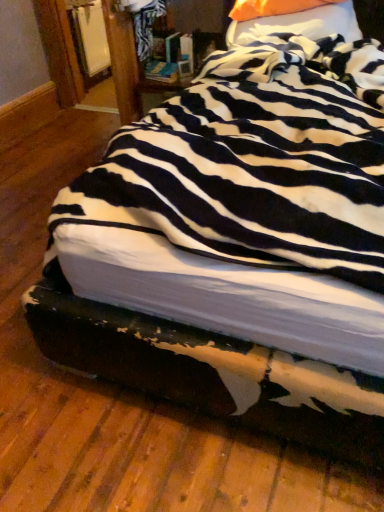
The height and width of the screenshot is (512, 384). What do you see at coordinates (291, 19) in the screenshot?
I see `orange fabric pillow at upper center, arranged as the second pillow when viewed from the top` at bounding box center [291, 19].

Image resolution: width=384 pixels, height=512 pixels. Find the location of `orange fabric pillow at upper center, arranged as the second pillow when viewed from the top`. orange fabric pillow at upper center, arranged as the second pillow when viewed from the top is located at coordinates (291, 19).

Find the location of a particular element. The height and width of the screenshot is (512, 384). orange fabric pillow at upper center, acting as the 2th pillow starting from the bottom is located at coordinates (273, 8).

Image resolution: width=384 pixels, height=512 pixels. What do you see at coordinates (273, 8) in the screenshot?
I see `orange fabric pillow at upper center, which is the first pillow in top-to-bottom order` at bounding box center [273, 8].

Where is `orange fabric pillow at upper center, which is the 1th pillow in bottom-to-top order`? Image resolution: width=384 pixels, height=512 pixels. orange fabric pillow at upper center, which is the 1th pillow in bottom-to-top order is located at coordinates (291, 19).

Which is more to the left, orange fabric pillow at upper center, arranged as the second pillow when viewed from the top, or orange fabric pillow at upper center, which is the first pillow in top-to-bottom order?

orange fabric pillow at upper center, arranged as the second pillow when viewed from the top.

Between orange fabric pillow at upper center, which is the 1th pillow in bottom-to-top order, and orange fabric pillow at upper center, which is the first pillow in top-to-bottom order, which one is positioned behind?

orange fabric pillow at upper center, which is the first pillow in top-to-bottom order, is more distant.

Is point (291, 2) farther from camera compared to point (249, 11)?

That is False.

From the image's perspective, would you say orange fabric pillow at upper center, which is the 1th pillow in bottom-to-top order, is shown under orange fabric pillow at upper center, acting as the 2th pillow starting from the bottom?

Indeed, from the image's perspective, orange fabric pillow at upper center, which is the 1th pillow in bottom-to-top order, is shown beneath orange fabric pillow at upper center, acting as the 2th pillow starting from the bottom.

From a real-world perspective, who is located higher, orange fabric pillow at upper center, which is the 1th pillow in bottom-to-top order, or orange fabric pillow at upper center, acting as the 2th pillow starting from the bottom?

orange fabric pillow at upper center, acting as the 2th pillow starting from the bottom.

Considering the sizes of objects orange fabric pillow at upper center, which is the 1th pillow in bottom-to-top order, and orange fabric pillow at upper center, acting as the 2th pillow starting from the bottom, in the image provided, who is wider, orange fabric pillow at upper center, which is the 1th pillow in bottom-to-top order, or orange fabric pillow at upper center, acting as the 2th pillow starting from the bottom,?

Wider between the two is orange fabric pillow at upper center, which is the 1th pillow in bottom-to-top order.

Does orange fabric pillow at upper center, which is the 1th pillow in bottom-to-top order, have a greater height compared to orange fabric pillow at upper center, which is the first pillow in top-to-bottom order?

Yes.

Between orange fabric pillow at upper center, which is the 1th pillow in bottom-to-top order, and orange fabric pillow at upper center, acting as the 2th pillow starting from the bottom, which one has larger size?

orange fabric pillow at upper center, which is the 1th pillow in bottom-to-top order.

Is orange fabric pillow at upper center, arranged as the second pillow when viewed from the top, inside the boundaries of orange fabric pillow at upper center, acting as the 2th pillow starting from the bottom, or outside?

orange fabric pillow at upper center, arranged as the second pillow when viewed from the top, is not inside orange fabric pillow at upper center, acting as the 2th pillow starting from the bottom, it's outside.

Would you say orange fabric pillow at upper center, arranged as the second pillow when viewed from the top, is a long distance from orange fabric pillow at upper center, which is the first pillow in top-to-bottom order?

orange fabric pillow at upper center, arranged as the second pillow when viewed from the top, is near orange fabric pillow at upper center, which is the first pillow in top-to-bottom order, not far away.

Is orange fabric pillow at upper center, acting as the 2th pillow starting from the bottom, at the back of orange fabric pillow at upper center, arranged as the second pillow when viewed from the top?

orange fabric pillow at upper center, arranged as the second pillow when viewed from the top, is not turned away from orange fabric pillow at upper center, acting as the 2th pillow starting from the bottom.

How different are the orientations of orange fabric pillow at upper center, arranged as the second pillow when viewed from the top, and orange fabric pillow at upper center, acting as the 2th pillow starting from the bottom, in degrees?

0.000245 degrees.

Image resolution: width=384 pixels, height=512 pixels. What are the coordinates of `pillow lying on the left of orange fabric pillow at upper center, acting as the 2th pillow starting from the bottom` in the screenshot? It's located at (291, 19).

Between orange fabric pillow at upper center, which is the first pillow in top-to-bottom order, and orange fabric pillow at upper center, which is the 1th pillow in bottom-to-top order, which one appears on the right side from the viewer's perspective?

orange fabric pillow at upper center, which is the first pillow in top-to-bottom order, is more to the right.

Which object is closer to the camera taking this photo, orange fabric pillow at upper center, acting as the 2th pillow starting from the bottom, or orange fabric pillow at upper center, arranged as the second pillow when viewed from the top?

Positioned in front is orange fabric pillow at upper center, arranged as the second pillow when viewed from the top.

Between point (240, 18) and point (301, 26), which one is positioned behind?

The point (240, 18) is behind.

From the image's perspective, who appears lower, orange fabric pillow at upper center, which is the first pillow in top-to-bottom order, or orange fabric pillow at upper center, which is the 1th pillow in bottom-to-top order?

orange fabric pillow at upper center, which is the 1th pillow in bottom-to-top order.

From a real-world perspective, is orange fabric pillow at upper center, acting as the 2th pillow starting from the bottom, physically below orange fabric pillow at upper center, arranged as the second pillow when viewed from the top?

No.

Between orange fabric pillow at upper center, acting as the 2th pillow starting from the bottom, and orange fabric pillow at upper center, which is the 1th pillow in bottom-to-top order, which one has smaller width?

orange fabric pillow at upper center, acting as the 2th pillow starting from the bottom, is thinner.

Can you confirm if orange fabric pillow at upper center, acting as the 2th pillow starting from the bottom, is shorter than orange fabric pillow at upper center, arranged as the second pillow when viewed from the top?

Yes.

Between orange fabric pillow at upper center, which is the first pillow in top-to-bottom order, and orange fabric pillow at upper center, which is the 1th pillow in bottom-to-top order, which one has smaller size?

orange fabric pillow at upper center, which is the first pillow in top-to-bottom order.

Is orange fabric pillow at upper center, arranged as the second pillow when viewed from the top, completely or partially inside orange fabric pillow at upper center, acting as the 2th pillow starting from the bottom?

No.

Are orange fabric pillow at upper center, acting as the 2th pillow starting from the bottom, and orange fabric pillow at upper center, arranged as the second pillow when viewed from the top, located far from each other?

No, orange fabric pillow at upper center, acting as the 2th pillow starting from the bottom, is not far from orange fabric pillow at upper center, arranged as the second pillow when viewed from the top.

Is orange fabric pillow at upper center, acting as the 2th pillow starting from the bottom, aimed at orange fabric pillow at upper center, which is the 1th pillow in bottom-to-top order?

Yes, orange fabric pillow at upper center, acting as the 2th pillow starting from the bottom, is facing orange fabric pillow at upper center, which is the 1th pillow in bottom-to-top order.

Can you tell me how much orange fabric pillow at upper center, acting as the 2th pillow starting from the bottom, and orange fabric pillow at upper center, arranged as the second pillow when viewed from the top, differ in facing direction?

0.000245 degrees separate the facing orientations of orange fabric pillow at upper center, acting as the 2th pillow starting from the bottom, and orange fabric pillow at upper center, arranged as the second pillow when viewed from the top.

Could you measure the distance between orange fabric pillow at upper center, which is the first pillow in top-to-bottom order, and orange fabric pillow at upper center, which is the 1th pillow in bottom-to-top order?

orange fabric pillow at upper center, which is the first pillow in top-to-bottom order, and orange fabric pillow at upper center, which is the 1th pillow in bottom-to-top order, are 8.79 centimeters apart.

The height and width of the screenshot is (512, 384). Find the location of `pillow that is on the left side of orange fabric pillow at upper center, which is the first pillow in top-to-bottom order`. pillow that is on the left side of orange fabric pillow at upper center, which is the first pillow in top-to-bottom order is located at coordinates (291, 19).

Image resolution: width=384 pixels, height=512 pixels. Identify the location of pillow located below the orange fabric pillow at upper center, acting as the 2th pillow starting from the bottom (from the image's perspective). (291, 19).

You are a GUI agent. You are given a task and a screenshot of the screen. Output one action in this format:
    pyautogui.click(x=<x>, y=<y>)
    Task: Click on the pillow on the left side of orange fabric pillow at upper center, which is the first pillow in top-to-bottom order
    This screenshot has height=512, width=384.
    Given the screenshot: What is the action you would take?
    pyautogui.click(x=291, y=19)